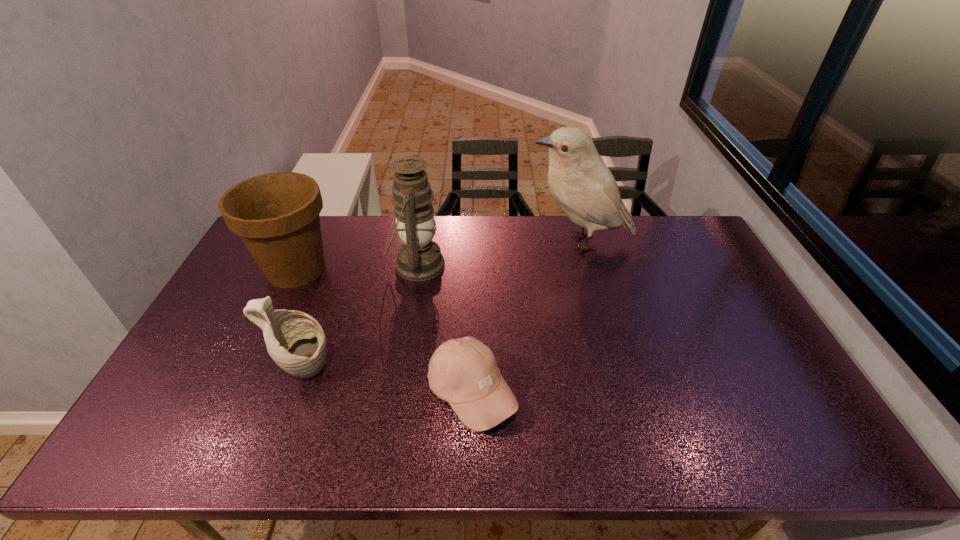
At what (x,y) coordinates should I click in order to perform the action: click on parakeet. Please return your answer as a coordinate pair (x, y). Looking at the image, I should click on (585, 189).

This screenshot has height=540, width=960. Find the location of `oil lamp`. oil lamp is located at coordinates (419, 258).

Find the location of `flowerpot`. flowerpot is located at coordinates (276, 215).

What are the coordinates of `pitcher` in the screenshot? It's located at (296, 341).

Identify the location of baseball cap. (464, 372).

In order to click on free region located 0.200m on the face of the parakeet in this screenshot , I will do `click(470, 242)`.

Image resolution: width=960 pixels, height=540 pixels. In order to click on vacant area located on the face of the parakeet in this screenshot , I will do `click(443, 242)`.

Locate an element on the screen. The image size is (960, 540). blank space located on the face of the parakeet is located at coordinates (459, 242).

This screenshot has width=960, height=540. Find the location of `free space located 0.230m on the right of the oil lamp`. free space located 0.230m on the right of the oil lamp is located at coordinates point(514,265).

This screenshot has height=540, width=960. I want to click on vacant space situated 0.060m on the back of the flowerpot, so click(313, 234).